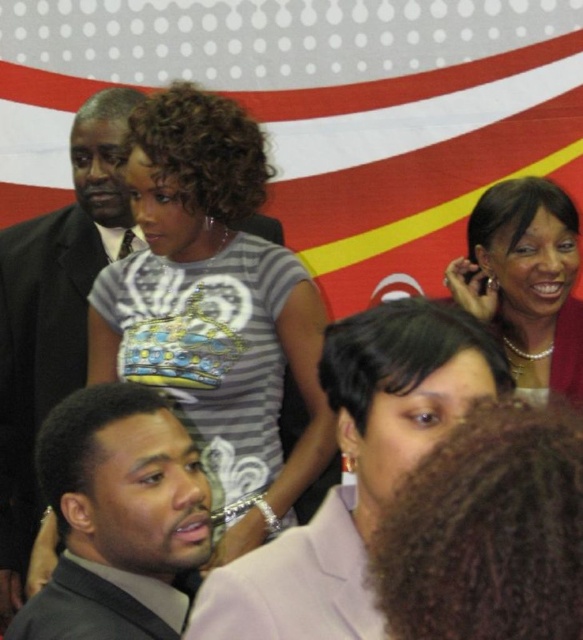
Between matte black suit at center and pearl necklace at upper right, which one appears on the left side from the viewer's perspective?

matte black suit at center is more to the left.

Can you confirm if matte black suit at center is smaller than pearl necklace at upper right?

Actually, matte black suit at center might be larger than pearl necklace at upper right.

Which is behind, point (12, 380) or point (512, 301)?

The point (12, 380) is behind.

Image resolution: width=583 pixels, height=640 pixels. What are the coordinates of `matte black suit at center` in the screenshot? It's located at (54, 316).

Which is above, dark gray suit at lower left or matte black suit at center?

Positioned higher is matte black suit at center.

Locate an element on the screen. This screenshot has width=583, height=640. dark gray suit at lower left is located at coordinates (120, 518).

Consider the image. Is dark gray suit at lower left shorter than pearl necklace at upper right?

Indeed, dark gray suit at lower left has a lesser height compared to pearl necklace at upper right.

Is point (26, 604) in front of point (472, 278)?

Yes, it is in front of point (472, 278).

In order to click on dark gray suit at lower left in this screenshot , I will do `click(120, 518)`.

The height and width of the screenshot is (640, 583). I want to click on dark gray suit at lower left, so [x=120, y=518].